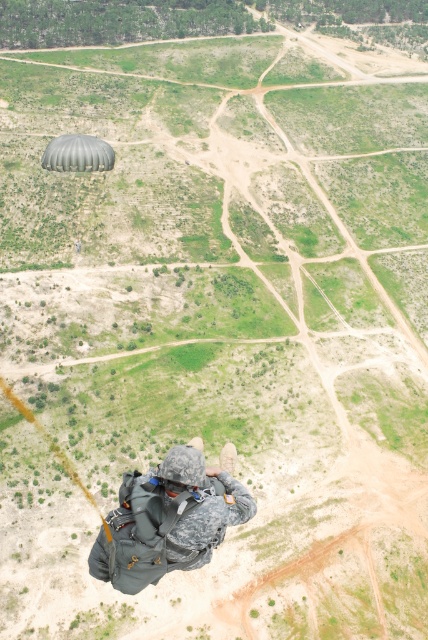
You are a military observer analyzing the parachute deployment. You notice the camouflage fabric helmet at center and the green matte parachute at upper center. Which object is closer to the ground?

The camouflage fabric helmet at center is closer to the ground because it is shorter than the green matte parachute at upper center.

You are a military instructor observing the parachutist from the ground. You need to determine the relative sizes of the objects to assess the parachutist equipment. Which object is wider, the camouflage fabric helmet at center or the green matte parachute at upper center?

The green matte parachute at upper center is wider than the camouflage fabric helmet at center.

Looking at this image, you are a military observer analyzing the parachute deployment from an aerial view. You see the camouflage fabric helmet at center and the green matte parachute at upper center. Which object is positioned higher in the frame?

The green matte parachute at upper center is positioned higher in the frame than the camouflage fabric helmet at center.